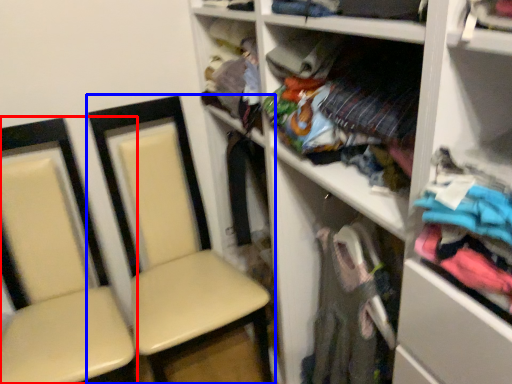
Question: Among these objects, which one is farthest to the camera, chair (highlighted by a red box) or chair (highlighted by a blue box)?

Choices:
 (A) chair
 (B) chair

Answer: (B)